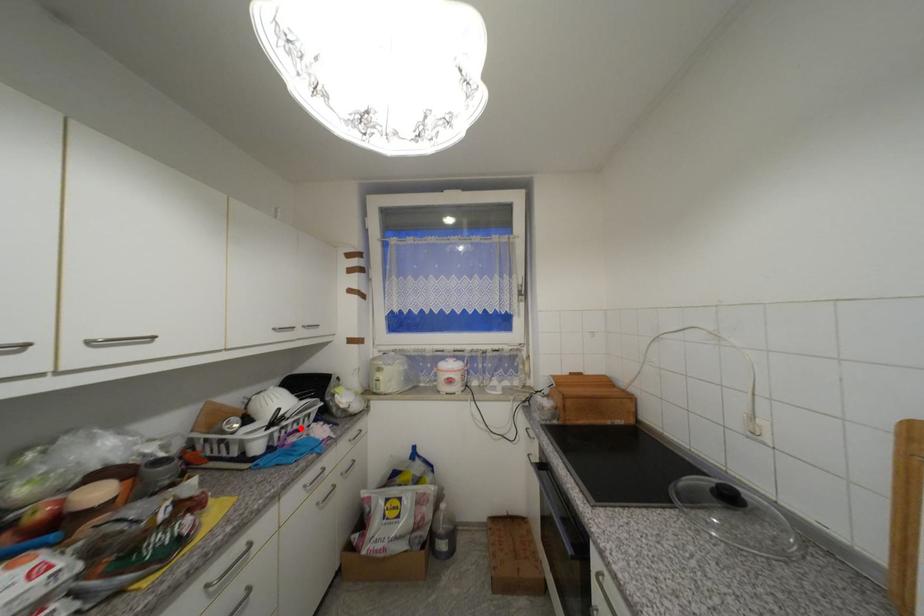
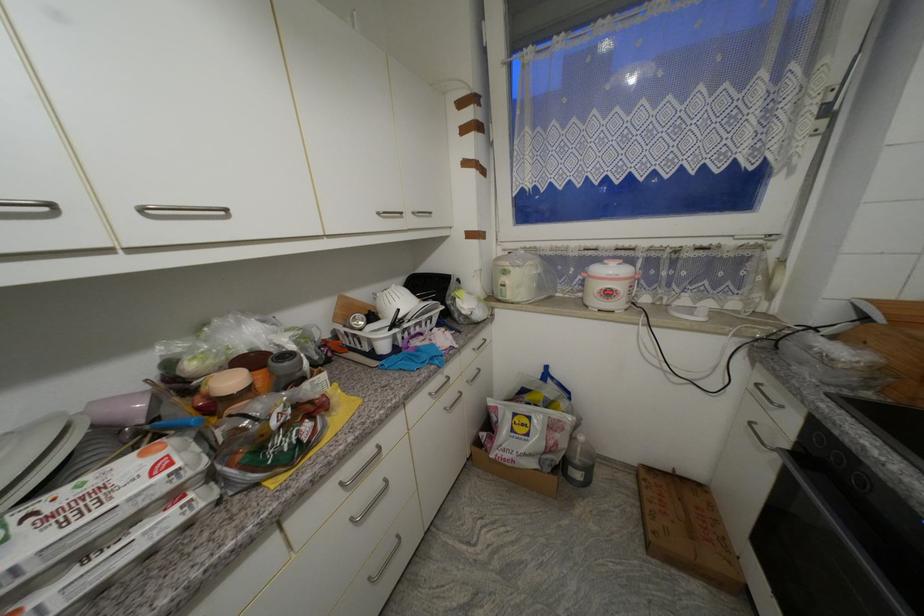
Where in the second image is the point corresponding to the highlighted location from the first image?

(423, 331)